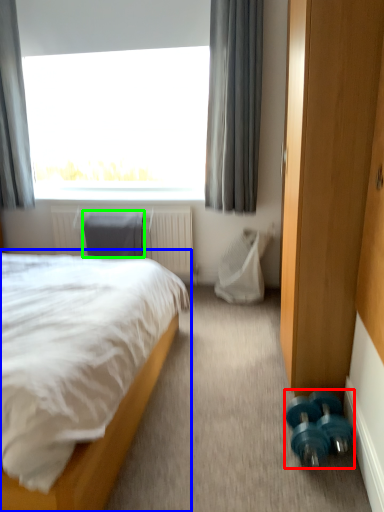
Question: Considering the real-world distances, which object is closest to dumbbell (highlighted by a red box)? bed (highlighted by a blue box) or swivel chair (highlighted by a green box).

Choices:
 (A) bed
 (B) swivel chair

Answer: (A)